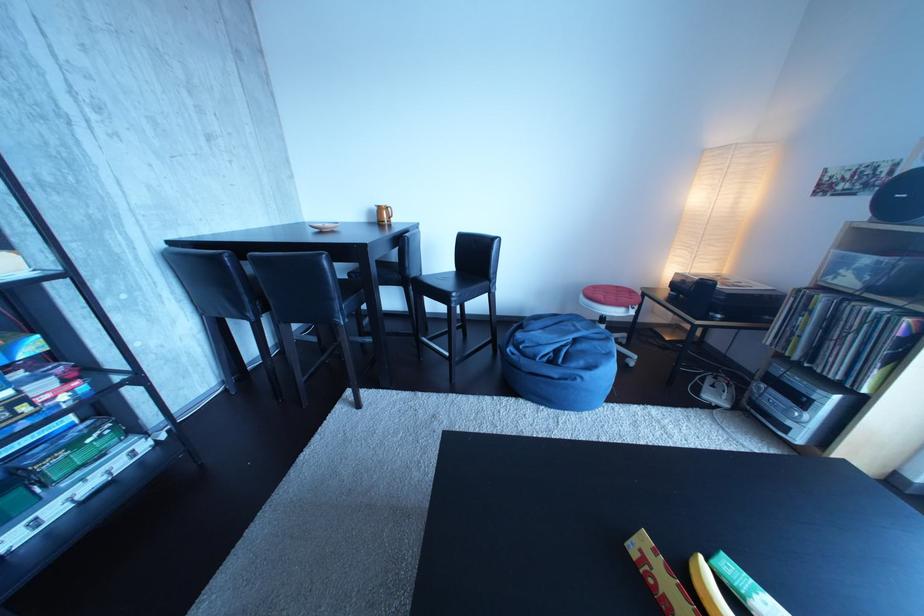
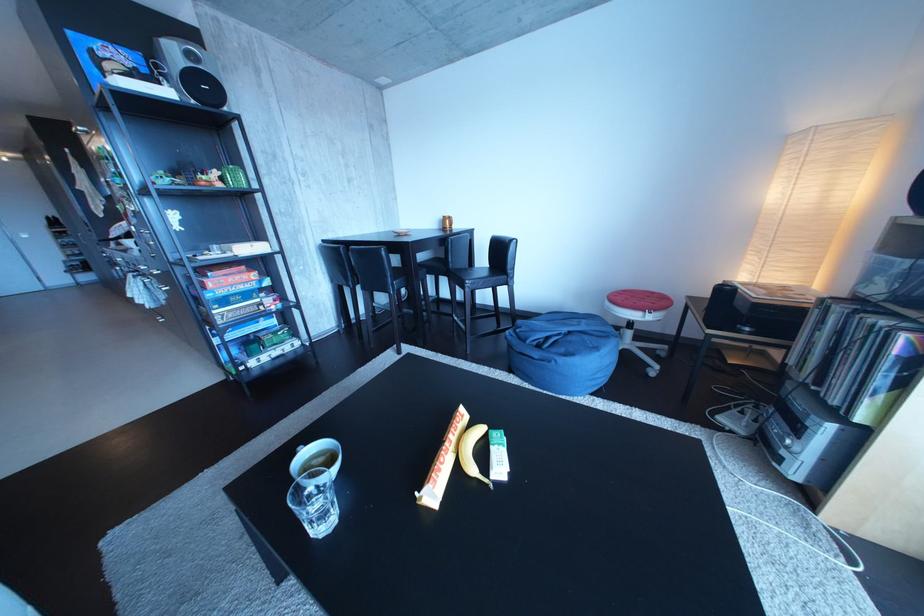
Find the pixel in the second image that matches point (589, 346) in the first image.

(582, 339)